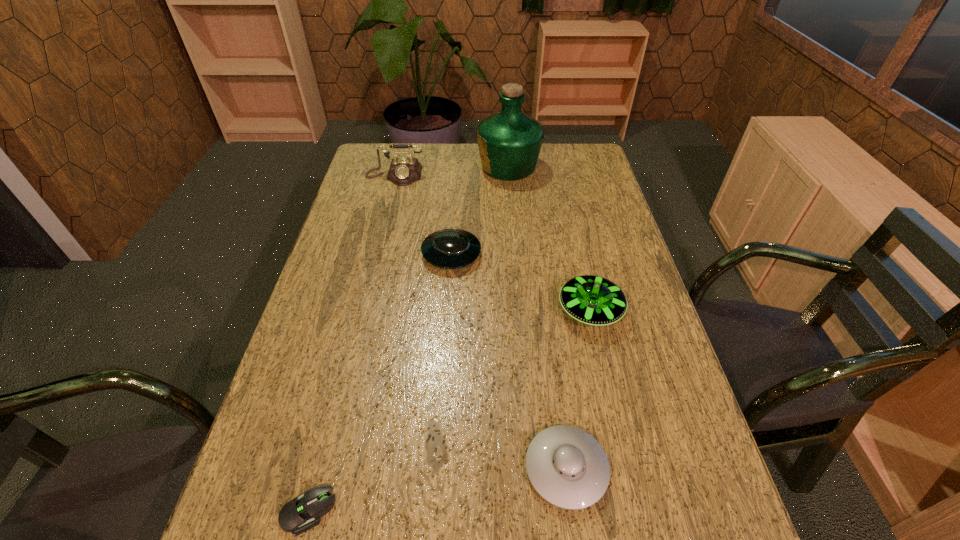
You are a GUI agent. You are given a task and a screenshot of the screen. Output one action in this format:
    pyautogui.click(x=<x>, y=<y>)
    Task: Click on the vacant space located on the label side of the liquor
    The image size is (960, 540).
    Given the screenshot: What is the action you would take?
    pyautogui.click(x=422, y=167)

Where is `vacant region located on the dial of the telephone`? The height and width of the screenshot is (540, 960). vacant region located on the dial of the telephone is located at coordinates (380, 234).

This screenshot has width=960, height=540. Find the location of `vacant space located on the front of the fourth farthest object`. vacant space located on the front of the fourth farthest object is located at coordinates (604, 368).

This screenshot has height=540, width=960. In order to click on vacant space situated 0.190m on the left of the leftmost saucer in this screenshot , I will do `click(357, 254)`.

Where is `free space located 0.400m on the back of the nearest saucer`? The image size is (960, 540). free space located 0.400m on the back of the nearest saucer is located at coordinates (541, 289).

Where is `vacant space located on the right of the shortest object`? The height and width of the screenshot is (540, 960). vacant space located on the right of the shortest object is located at coordinates (374, 511).

In order to click on liquor present at the far edge in this screenshot , I will do `click(509, 142)`.

Identify the location of telephone located in the far edge section of the desktop. This screenshot has height=540, width=960. (403, 171).

The width and height of the screenshot is (960, 540). Find the location of `telephone that is at the left edge`. telephone that is at the left edge is located at coordinates (403, 171).

Locate an element on the screen. The height and width of the screenshot is (540, 960). computer mouse present at the left edge is located at coordinates point(297,516).